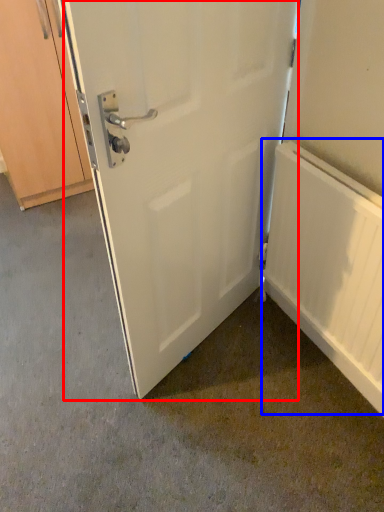
Question: Which object appears closest to the camera in this image, door (highlighted by a red box) or radiator (highlighted by a blue box)?

Choices:
 (A) door
 (B) radiator

Answer: (A)